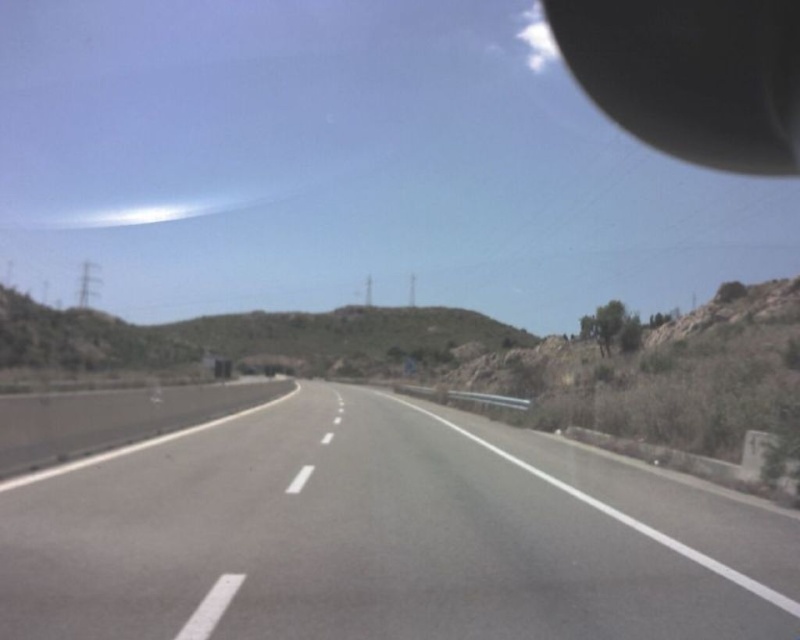
Between smooth asphalt highway at center and black matte rearview mirror at upper right, which one is positioned lower?

smooth asphalt highway at center

Does point (206, 563) come in front of point (588, 42)?

That is True.

Between point (472, 502) and point (630, 68), which one is positioned behind?

Point (630, 68)

Identify the location of smooth asphalt highway at center. (384, 538).